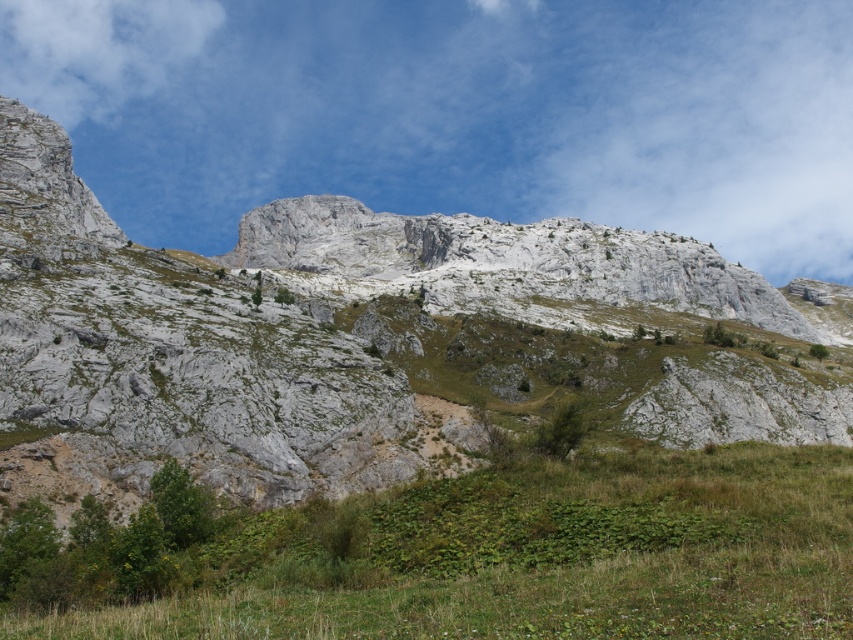
Question: Does gray rock mountain at center appear under green grassy at lower center?

Choices:
 (A) no
 (B) yes

Answer: (A)

Question: Among these objects, which one is farthest from the camera?

Choices:
 (A) gray rock mountain at center
 (B) green grassy at lower center

Answer: (A)

Question: Which object appears closest to the camera in this image?

Choices:
 (A) gray rock mountain at center
 (B) green grassy at lower center

Answer: (B)

Question: Does gray rock mountain at center appear on the left side of green grassy at lower center?

Choices:
 (A) no
 (B) yes

Answer: (B)

Question: Is gray rock mountain at center closer to the viewer compared to green grassy at lower center?

Choices:
 (A) no
 (B) yes

Answer: (A)

Question: Which of the following is the closest to the observer?

Choices:
 (A) gray rock mountain at center
 (B) green grassy at lower center

Answer: (B)